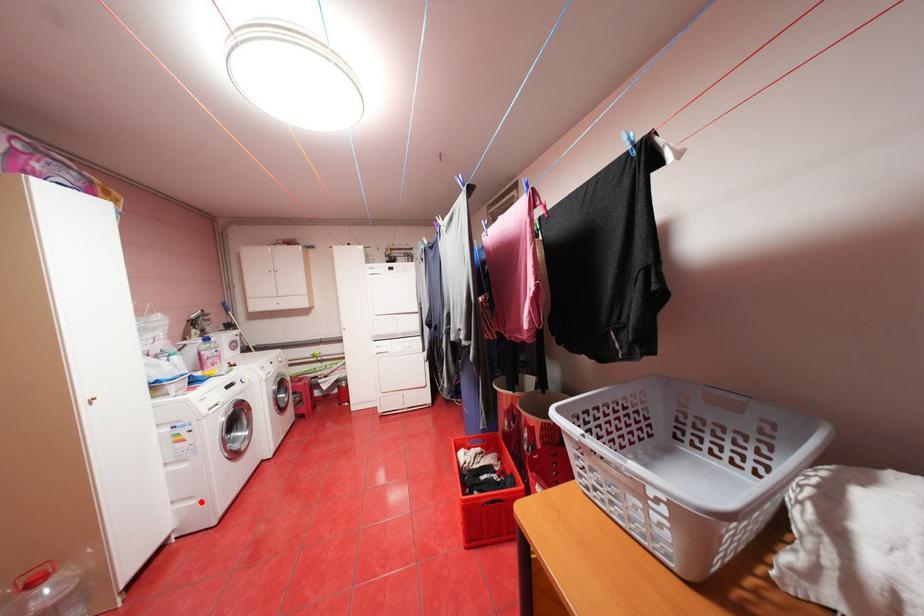
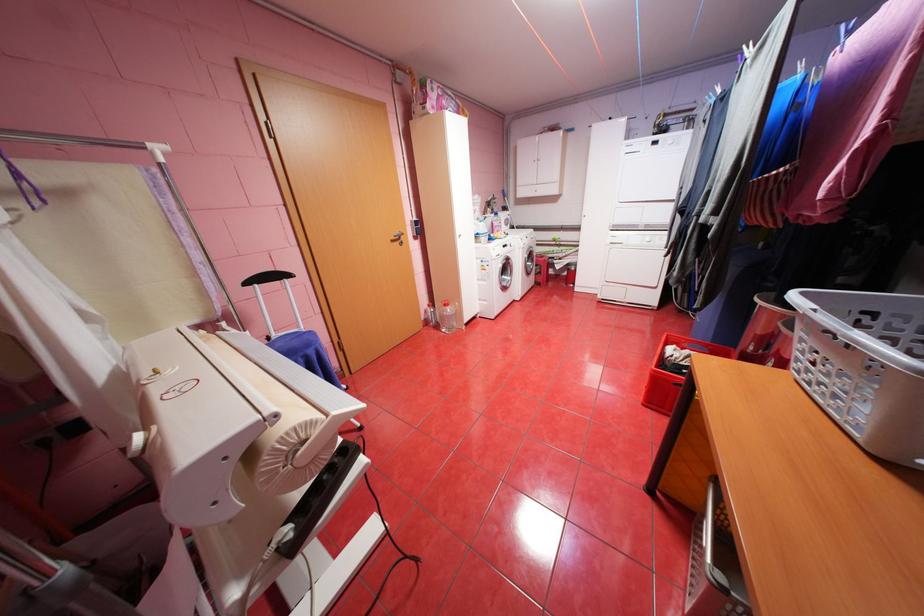
Locate, in the second image, the point that corresponds to the highlighted location in the first image.

(494, 302)